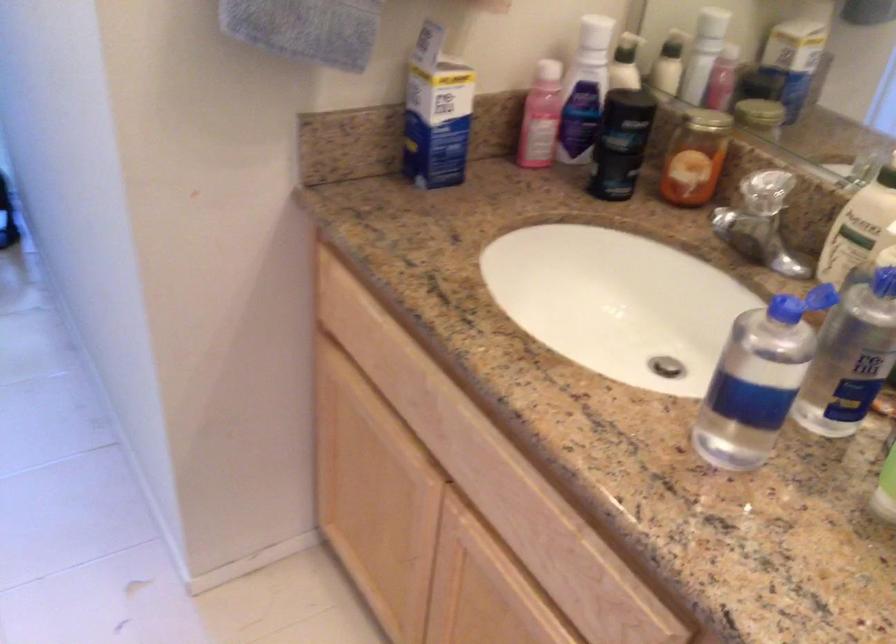
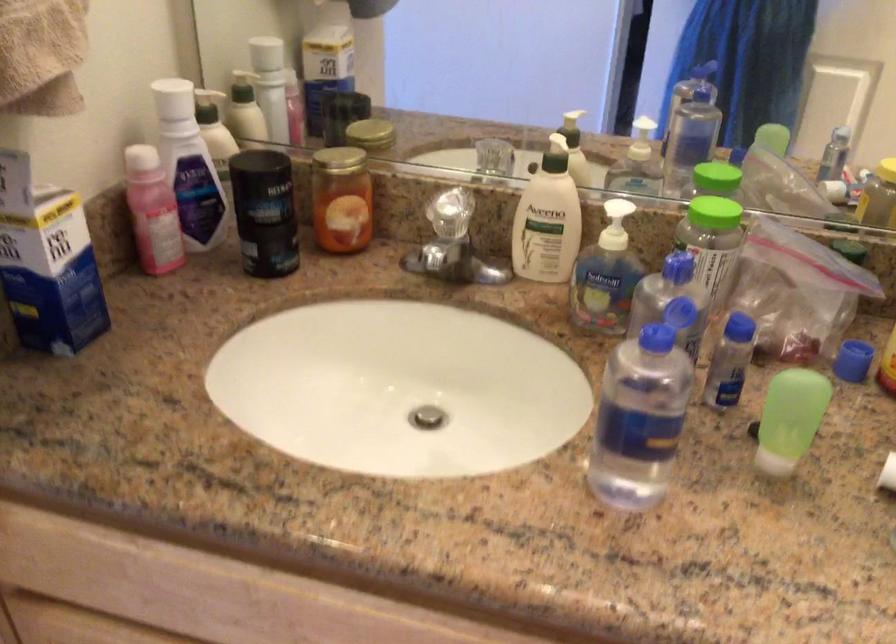
Where in the second image is the point corresponding to point 693,116 from the first image?

(336, 160)